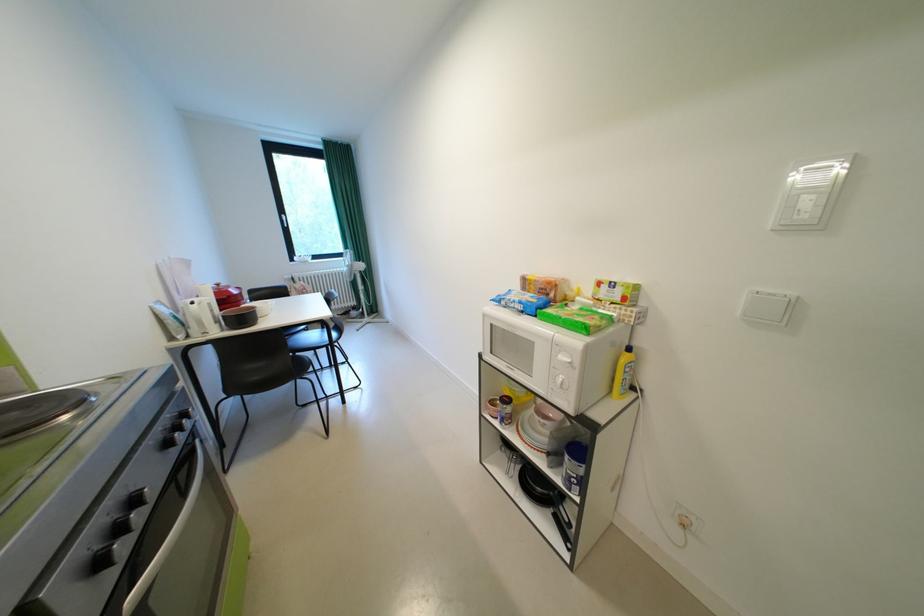
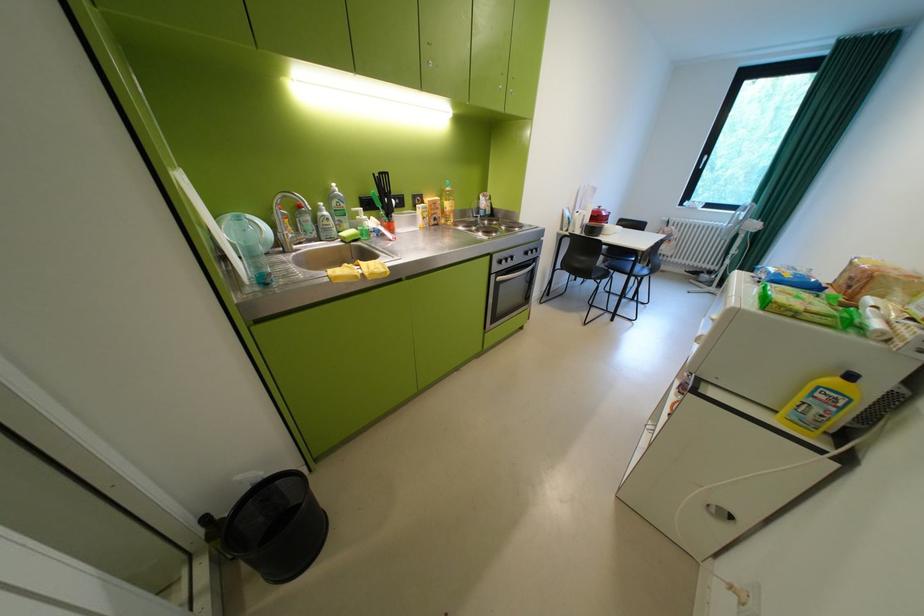
Locate, in the second image, the point that corresponds to (638,371) in the first image.

(830, 395)